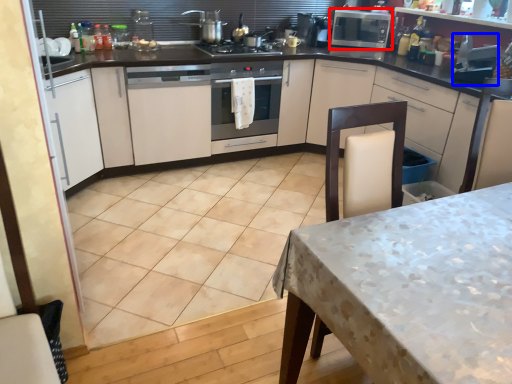
Question: Which of the following is the farthest to the observer, kitchen appliance (highlighted by a red box) or appliance (highlighted by a blue box)?

Choices:
 (A) kitchen appliance
 (B) appliance

Answer: (A)